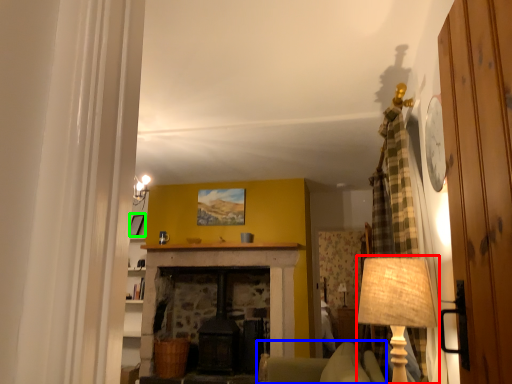
Question: Which object is positioned closest to table lamp (highlighted by a red box)? Select from armchair (highlighted by a blue box) and picture frame (highlighted by a green box).

Choices:
 (A) armchair
 (B) picture frame

Answer: (B)